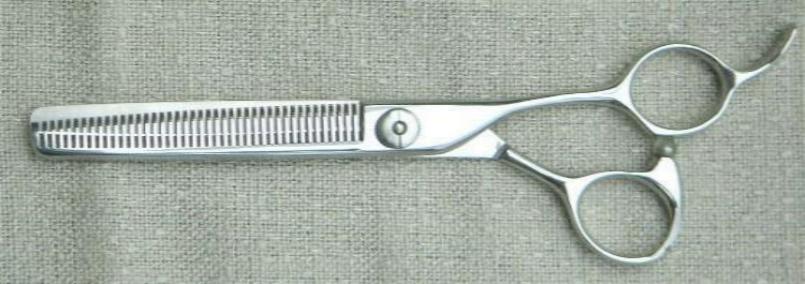
Where is `metal hook`? metal hook is located at coordinates (769, 58).